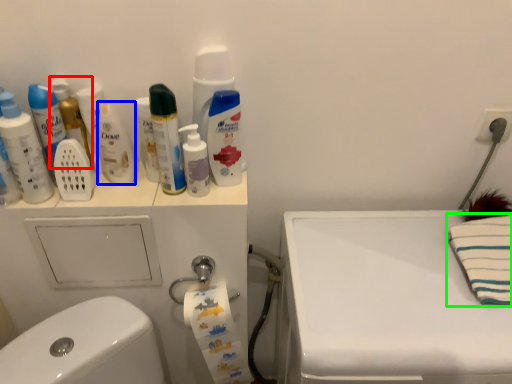
Question: Which object is the closest to the mouthwash (highlighted by a red box)? Choose among these: mouthwash (highlighted by a blue box) or beach towel (highlighted by a green box).

Choices:
 (A) mouthwash
 (B) beach towel

Answer: (A)